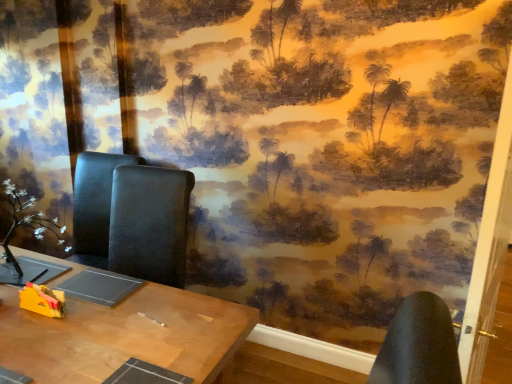
In order to click on free spot above wooden table at center (from a real-world perspective) in this screenshot , I will do point(101,316).